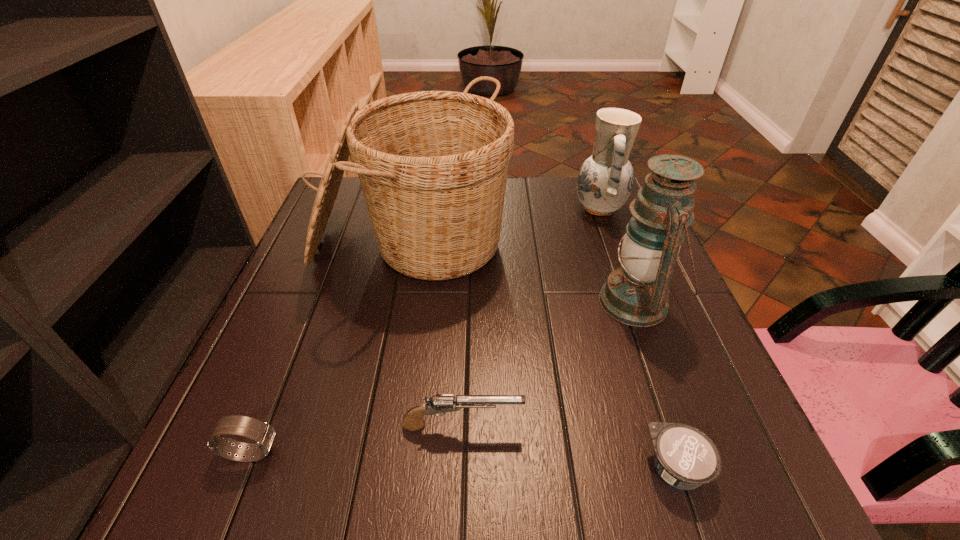
This screenshot has height=540, width=960. Find the location of `oil lamp that is positioned at the right edge`. oil lamp that is positioned at the right edge is located at coordinates (636, 294).

Image resolution: width=960 pixels, height=540 pixels. I want to click on pottery situated at the right edge, so click(605, 180).

Image resolution: width=960 pixels, height=540 pixels. Find the location of `yogurt that is at the right edge`. yogurt that is at the right edge is located at coordinates (685, 457).

Where is `object that is at the far left corner`? The image size is (960, 540). object that is at the far left corner is located at coordinates (433, 165).

Where is `object positioned at the near left corner`? The height and width of the screenshot is (540, 960). object positioned at the near left corner is located at coordinates (263, 434).

This screenshot has height=540, width=960. I want to click on object at the far right corner, so click(x=605, y=180).

Locate an element on the screen. object that is at the near right corner is located at coordinates (685, 457).

Find the location of `vacant space at the left edge`. vacant space at the left edge is located at coordinates (299, 271).

At what (x,y) coordinates should I click in order to perform the action: click on free space at the right edge of the desktop. Please return your answer as a coordinate pair (x, y). The height and width of the screenshot is (540, 960). Looking at the image, I should click on (625, 232).

This screenshot has width=960, height=540. Find the location of `vacant space at the far left corner of the desktop`. vacant space at the far left corner of the desktop is located at coordinates (359, 213).